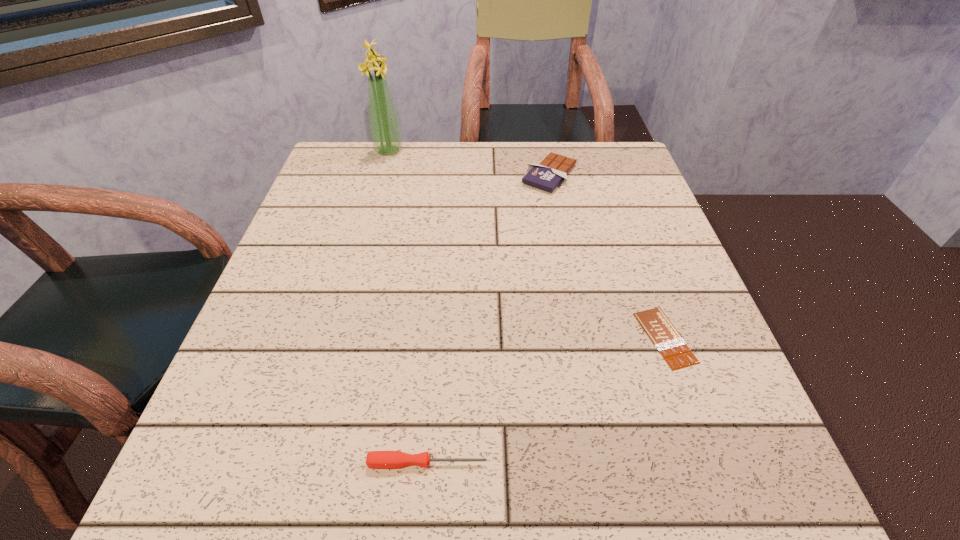
Where is `vacant space situated at the tip of the third object from right to left`? The width and height of the screenshot is (960, 540). vacant space situated at the tip of the third object from right to left is located at coordinates (609, 463).

Identify the location of free space located 0.240m on the left of the nearer chocolate bar. (502, 338).

You are a GUI agent. You are given a task and a screenshot of the screen. Output one action in this format:
    pyautogui.click(x=<x>, y=<y>)
    Task: Click on the bouquet at the far edge
    
    Given the screenshot: What is the action you would take?
    pyautogui.click(x=385, y=130)

Where is `chocolate bar that is positioned at the far edge`? chocolate bar that is positioned at the far edge is located at coordinates (552, 170).

Locate an element on the screen. object positioned at the near edge is located at coordinates (375, 459).

Find the location of a particular element. object that is at the left edge is located at coordinates (385, 130).

The image size is (960, 540). Find the location of `object present at the far left corner`. object present at the far left corner is located at coordinates (385, 130).

The height and width of the screenshot is (540, 960). I want to click on object that is at the far right corner, so click(x=552, y=170).

Where is `vacant area at the far edge of the desktop`? Image resolution: width=960 pixels, height=540 pixels. vacant area at the far edge of the desktop is located at coordinates (418, 181).

In the image, there is a desktop. Where is `vacant space at the near edge`? vacant space at the near edge is located at coordinates (625, 471).